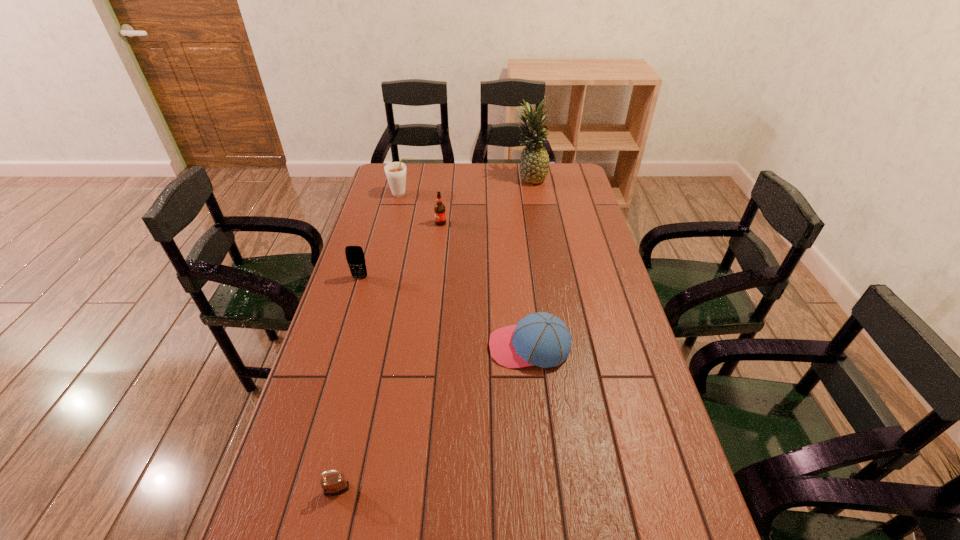
Find the location of a particular element. The width and height of the screenshot is (960, 540). unoccupied position between the fifth nearest object and the pineapple is located at coordinates (466, 186).

Where is `free area in between the fourth farthest object and the fifth farthest object`? free area in between the fourth farthest object and the fifth farthest object is located at coordinates (444, 312).

Identify the location of free spot between the shorter root beer and the fifth farthest object. (485, 285).

The height and width of the screenshot is (540, 960). I want to click on vacant area that lies between the baseball cap and the nearest object, so click(433, 418).

Identify the location of blank region between the left root beer and the fifth farthest object. This screenshot has width=960, height=540. (466, 271).

Where is `free space between the baseball cap and the cellular telephone`? This screenshot has width=960, height=540. free space between the baseball cap and the cellular telephone is located at coordinates (444, 312).

Locate an element on the screen. Image resolution: width=960 pixels, height=540 pixels. empty space between the cellular telephone and the fifth tallest object is located at coordinates (444, 312).

At what (x,y) coordinates should I click in order to perform the action: click on vacant space that's between the fifth shortest object and the baseball cap. Please return your answer as a coordinate pair (x, y). This screenshot has width=960, height=540. Looking at the image, I should click on (466, 271).

Locate an element on the screen. The image size is (960, 540). vacant point located between the shortest object and the fourth farthest object is located at coordinates (348, 383).

The width and height of the screenshot is (960, 540). Identify the location of empty space that is in between the padlock and the tallest object. (433, 334).